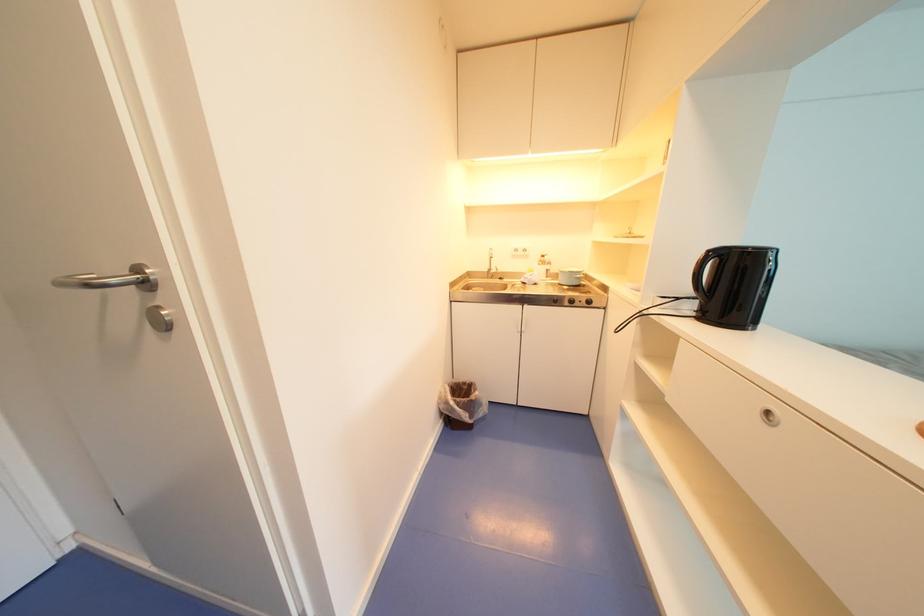
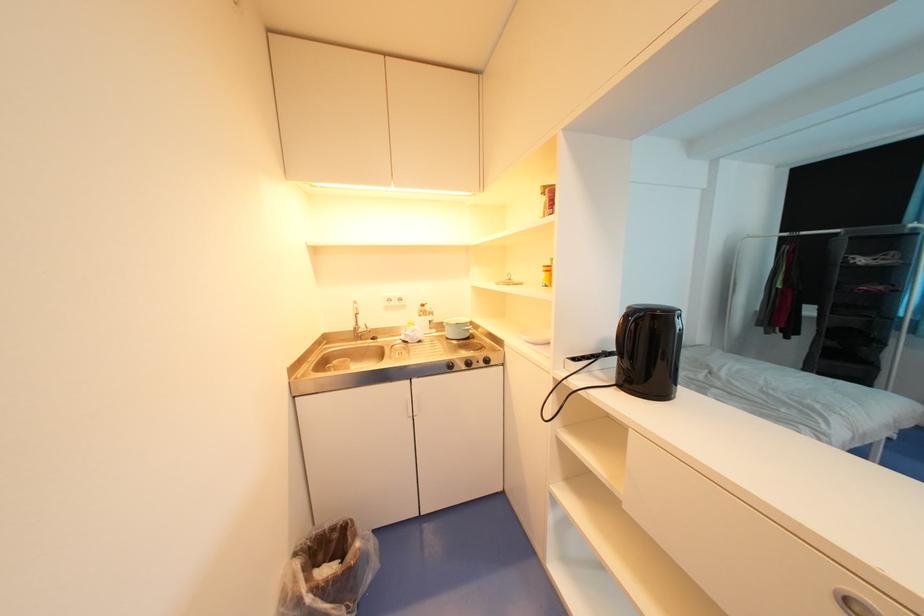
Question: The camera is either moving clockwise (left) or counter-clockwise (right) around the object. The first image is from the beginning of the video and the second image is from the end. Is the camera moving left or right when shooting the video?

Choices:
 (A) Left
 (B) Right

Answer: (A)